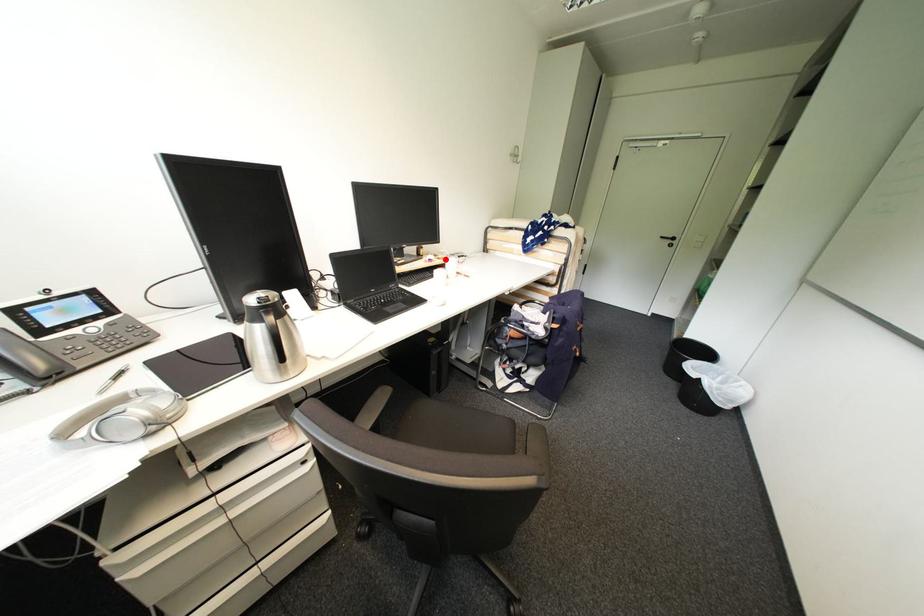
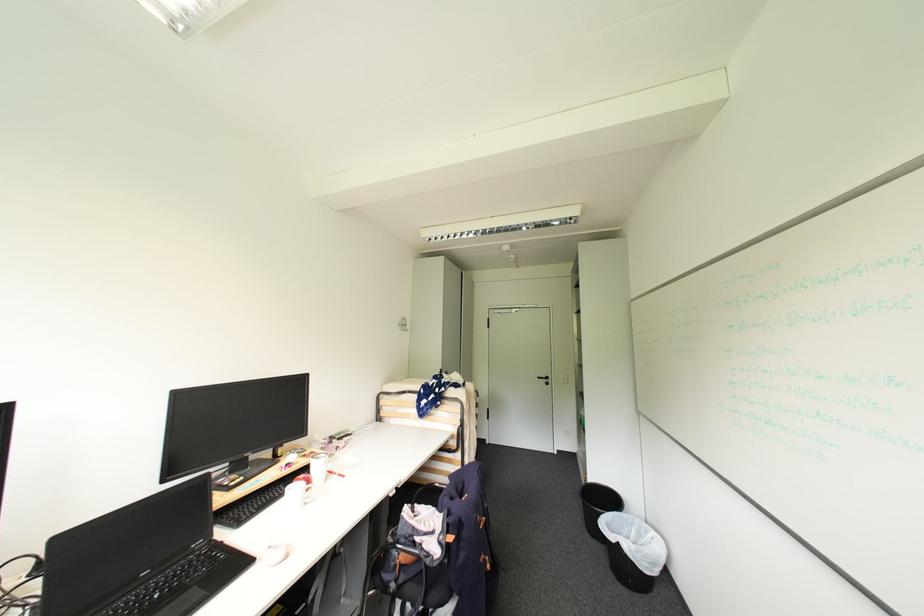
The point at the highlighted location is marked in the first image. Where is the corresponding point in the second image?

(311, 456)